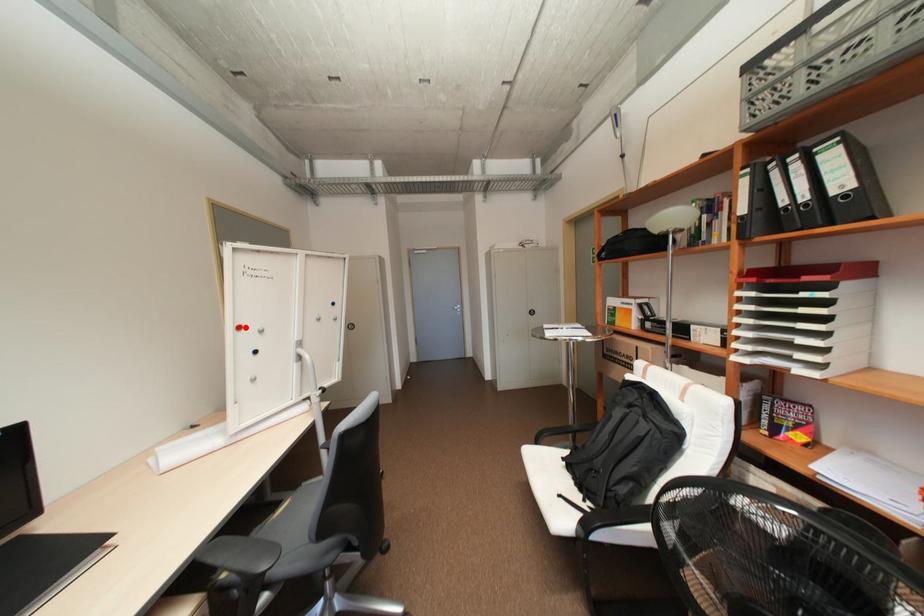
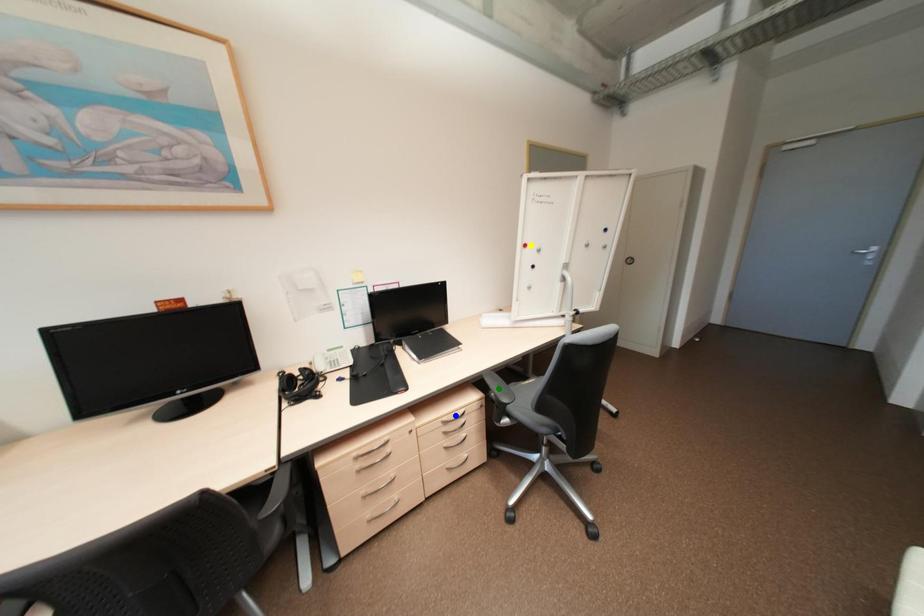
Question: I am providing you with two images of the same scene from different viewpoints. A red point is marked on the first image. You are given multiple points on the second image. Which spot in image 2 lines up with the point in image 1?

Choices:
 (A) yellow point
 (B) blue point
 (C) green point

Answer: (A)